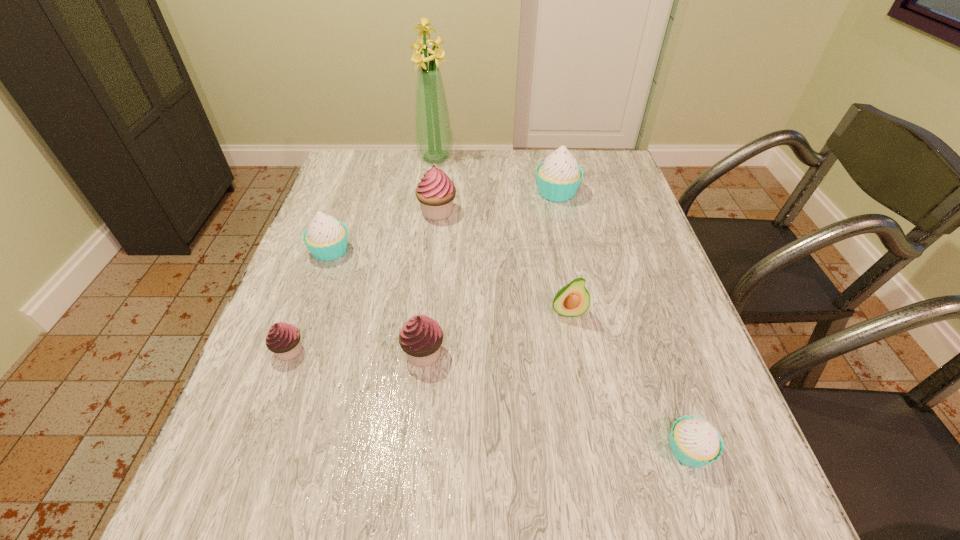
At what (x,y) coordinates should I click in order to perform the action: click on the smallest pink cupcake. Please return your answer as a coordinate pair (x, y). Looking at the image, I should click on (283, 339).

Identify the location of the rightmost white cupcake. (695, 442).

Identify the location of the nearest object. This screenshot has height=540, width=960. (695, 442).

Identify the location of free space located 0.360m on the front-facing side of the tallest object. Image resolution: width=960 pixels, height=540 pixels. (424, 240).

Where is `vacant space situated 0.120m on the right of the farthest white cupcake`? vacant space situated 0.120m on the right of the farthest white cupcake is located at coordinates (620, 192).

Locate an element on the screen. vacant area situated 0.220m on the front of the farthest pink cupcake is located at coordinates 430,282.

Where is `vacant space located 0.130m on the right of the second smallest white cupcake`? This screenshot has height=540, width=960. vacant space located 0.130m on the right of the second smallest white cupcake is located at coordinates (403, 251).

This screenshot has height=540, width=960. I want to click on vacant space situated 0.090m on the back of the second biggest pink cupcake, so click(429, 304).

At what (x,y) coordinates should I click in order to perform the action: click on vacant point located 0.300m on the cut side of the avocado. Please return your answer as a coordinate pair (x, y). The image size is (960, 540). Looking at the image, I should click on (595, 457).

This screenshot has width=960, height=540. Find the location of `vacant space positioned on the back of the smallest pink cupcake`. vacant space positioned on the back of the smallest pink cupcake is located at coordinates (337, 221).